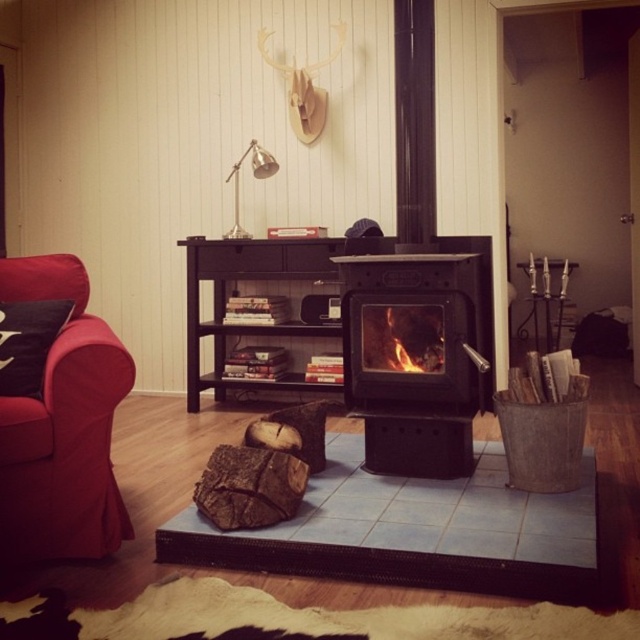
You are sitting in the living room and want to place a small decorative item on the surface that is between the brown rough wood at center and the flaming wood at center. Is this possible?

The brown rough wood at center is below the flaming wood at center, so there is no flat surface between them for placing a decorative item.

You are a fire safety inspector checking the distance between the black cast iron fireplace at center and the flaming wood at center. The minimum safety distance required is 4 inches. Is the current distance compliant with safety standards?

The distance between the black cast iron fireplace at center and the flaming wood at center is 3.50 inches, which is less than the required 4 inches. Therefore, it does not comply with safety standards.

You are standing in the living room and want to place a decorative item on the surface of the black cast iron fireplace at center. However, there is already flaming wood at center. Is the fireplace surface currently available for placing the item?

The black cast iron fireplace at center is located below the flaming wood at center, which means the flaming wood is on top of the fireplace. Therefore, the fireplace surface is occupied by the flaming wood and not available for placing the decorative item.